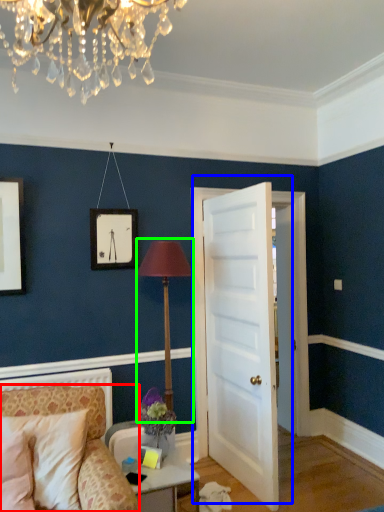
Question: Based on their relative distances, which object is nearer to chair (highlighted by a red box)? Choose from door (highlighted by a blue box) and table lamp (highlighted by a green box).

Choices:
 (A) door
 (B) table lamp

Answer: (B)